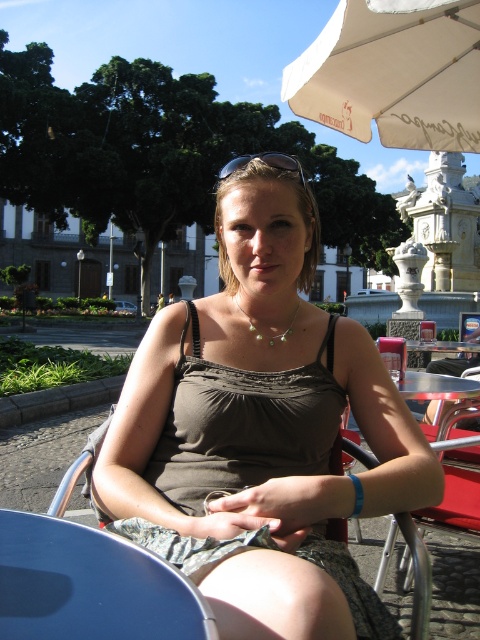
Question: Which point appears farthest from the camera in this image?

Choices:
 (A) (337, 20)
 (B) (274, 468)

Answer: (A)

Question: Does blue glossy table at lower left appear on the right side of pearl necklace at center?

Choices:
 (A) no
 (B) yes

Answer: (A)

Question: Which object is the farthest from the matte brown tank top at center?

Choices:
 (A) white fabric umbrella at upper center
 (B) sunglasses at center
 (C) pearl necklace at center
 (D) blue glossy table at lower left

Answer: (A)

Question: In this image, where is sunglasses at center located relative to pearl necklace at center?

Choices:
 (A) below
 (B) above

Answer: (B)

Question: Which object is the closest to the blue glossy table at lower left?

Choices:
 (A) white fabric umbrella at upper center
 (B) pearl necklace at center
 (C) sunglasses at center
 (D) matte brown tank top at center

Answer: (D)

Question: Is matte brown tank top at center smaller than sunglasses at center?

Choices:
 (A) no
 (B) yes

Answer: (B)